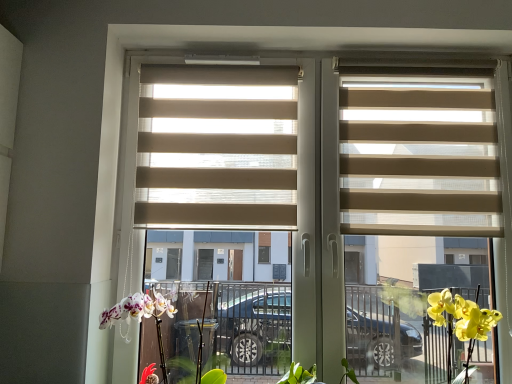
Question: Is beige fabric blinds at right, marked as the first window blind in a right-to-left arrangement, beside beige fabric blinds at center?

Choices:
 (A) yes
 (B) no

Answer: (B)

Question: Does beige fabric blinds at right, marked as the first window blind in a right-to-left arrangement, turn towards beige fabric blinds at center?

Choices:
 (A) yes
 (B) no

Answer: (A)

Question: Considering the relative positions of beige fabric blinds at right, placed as the second window blind when sorted from left to right, and beige fabric blinds at center in the image provided, is beige fabric blinds at right, placed as the second window blind when sorted from left to right, behind beige fabric blinds at center?

Choices:
 (A) no
 (B) yes

Answer: (B)

Question: Would you say beige fabric blinds at right, placed as the second window blind when sorted from left to right, is outside beige fabric blinds at center?

Choices:
 (A) yes
 (B) no

Answer: (B)

Question: Is beige fabric blinds at right, placed as the second window blind when sorted from left to right, closer to camera compared to beige fabric blinds at center?

Choices:
 (A) no
 (B) yes

Answer: (A)

Question: Considering the relative positions of beige fabric blinds at right, marked as the first window blind in a right-to-left arrangement, and beige fabric blinds at center in the image provided, is beige fabric blinds at right, marked as the first window blind in a right-to-left arrangement, to the right of beige fabric blinds at center from the viewer's perspective?

Choices:
 (A) yes
 (B) no

Answer: (A)

Question: Is white matte orchid at lower left a part of beige fabric blinds at center, the 2th window blind from the right?

Choices:
 (A) yes
 (B) no

Answer: (B)

Question: Is beige fabric blinds at center, the 1th window blind viewed from the left, wider than white matte orchid at lower left?

Choices:
 (A) yes
 (B) no

Answer: (B)

Question: Can you confirm if beige fabric blinds at center, the 1th window blind viewed from the left, is smaller than white matte orchid at lower left?

Choices:
 (A) no
 (B) yes

Answer: (B)

Question: Can you confirm if beige fabric blinds at center, the 1th window blind viewed from the left, is bigger than white matte orchid at lower left?

Choices:
 (A) no
 (B) yes

Answer: (A)

Question: Is beige fabric blinds at center, the 2th window blind from the right, behind white matte orchid at lower left?

Choices:
 (A) no
 (B) yes

Answer: (B)

Question: Is beige fabric blinds at center at the right side of beige fabric blinds at right, marked as the first window blind in a right-to-left arrangement?

Choices:
 (A) no
 (B) yes

Answer: (A)